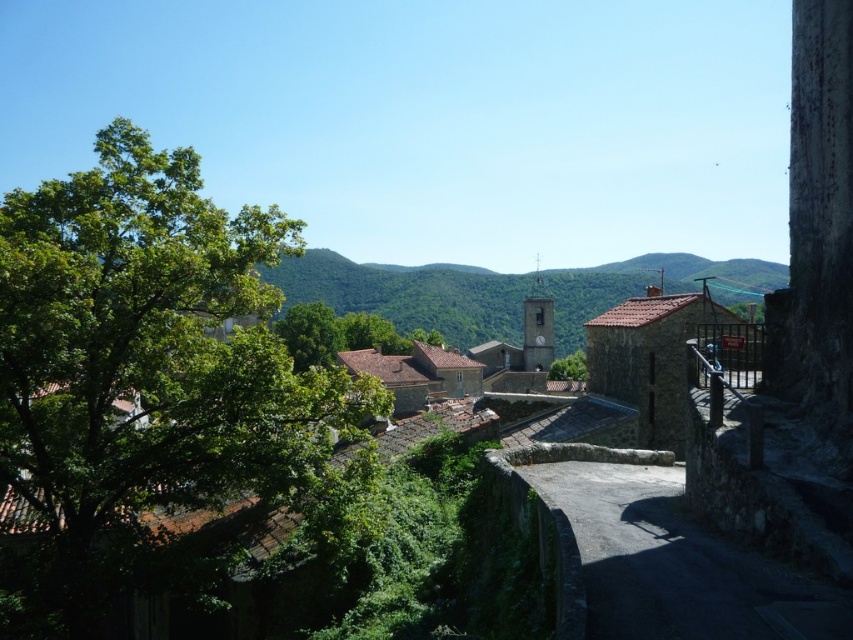
Question: Which of these objects is positioned closest to the green leafy tree at upper left?

Choices:
 (A) green leafy tree at center
 (B) dark stone alley at center

Answer: (B)

Question: Estimate the real-world distances between objects in this image. Which object is farther from the green leafy tree at center?

Choices:
 (A) green leafy tree at upper left
 (B) dark stone alley at center

Answer: (B)

Question: Does green leafy tree at upper left appear over green leafy tree at center?

Choices:
 (A) no
 (B) yes

Answer: (B)

Question: Which of the following is the closest to the observer?

Choices:
 (A) green leafy tree at center
 (B) green leafy tree at upper left
 (C) dark stone alley at center

Answer: (C)

Question: Can you confirm if green leafy tree at upper left is smaller than green leafy tree at center?

Choices:
 (A) yes
 (B) no

Answer: (B)

Question: Is green leafy tree at upper left thinner than dark stone alley at center?

Choices:
 (A) yes
 (B) no

Answer: (B)